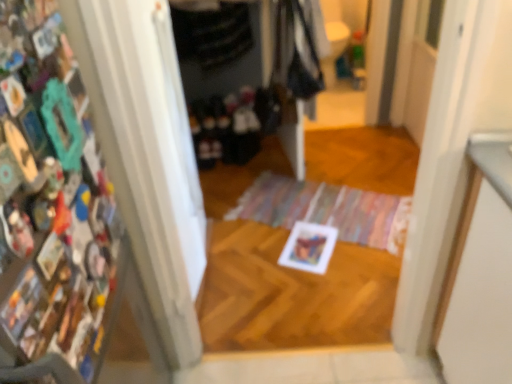
The image size is (512, 384). Find the location of `free space above multicolored woven mat at center (from a real-world perspective)`. free space above multicolored woven mat at center (from a real-world perspective) is located at coordinates pos(313,201).